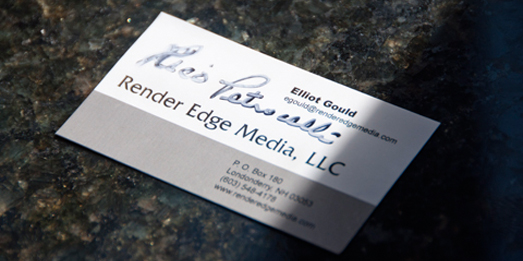
This screenshot has height=261, width=523. Identify the location of beige specks in granite countertop. (165, 217), (52, 207), (397, 44).